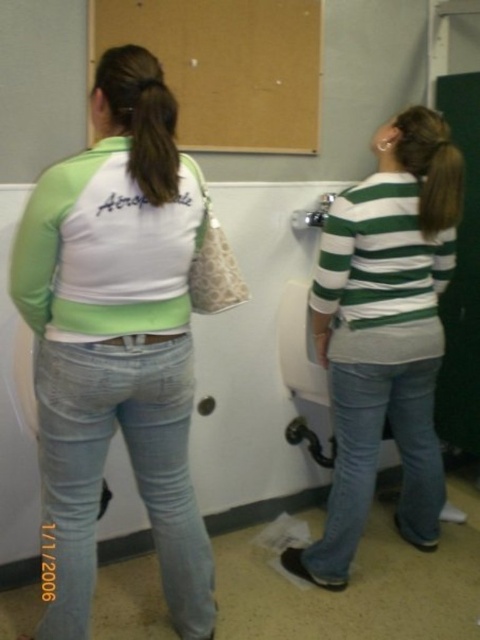
Can you confirm if light blue denim jeans at lower left is positioned to the left of brown hair at upper center?

Correct, you'll find light blue denim jeans at lower left to the left of brown hair at upper center.

Is light blue denim jeans at lower left to the right of brown hair at upper center from the viewer's perspective?

In fact, light blue denim jeans at lower left is to the left of brown hair at upper center.

The height and width of the screenshot is (640, 480). What do you see at coordinates (103, 468) in the screenshot?
I see `light blue denim jeans at lower left` at bounding box center [103, 468].

I want to click on light blue denim jeans at lower left, so click(x=103, y=468).

Is the position of light blue denim jeans at lower left more distant than that of brown silky hair at upper left?

That is True.

At what (x,y) coordinates should I click in order to perform the action: click on light blue denim jeans at lower left. Please return your answer as a coordinate pair (x, y). Looking at the image, I should click on pyautogui.click(x=103, y=468).

Where is `light blue denim jeans at lower left`? light blue denim jeans at lower left is located at coordinates (103, 468).

Is light blue denim jeans at center positioned in front of blue denim jeans at lower right?

Yes.

Can you confirm if light blue denim jeans at center is wider than blue denim jeans at lower right?

Incorrect, light blue denim jeans at center's width does not surpass blue denim jeans at lower right's.

Which is behind, point (166, 163) or point (411, 474)?

The point (411, 474) is behind.

This screenshot has height=640, width=480. Identify the location of light blue denim jeans at center. (116, 340).